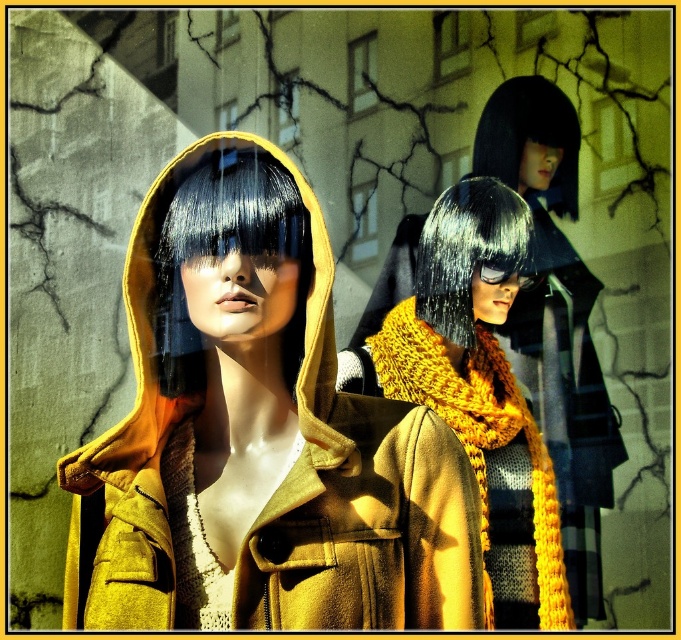
You are a photographer setting up a shoot in this scene. You need to position a spotlight so that it illuminates both the shiny black hair at center and the black silky hair at upper center without casting shadows over other parts of the image. Based on their positions, where should you place the spotlight relative to these two objects?

The shiny black hair at center is to the left of the black silky hair at upper center. To avoid casting shadows over other parts of the image, the spotlight should be placed to the right of both the shiny black hair at center and the black silky hair at upper center.

You are a fashion designer examining the mannequin in the image. You need to adjust the placement of the knitted yellow scarf at center and the black matte wig at center so that the scarf is above the wig. Is this possible without moving the wig?

The knitted yellow scarf at center is currently located below the black matte wig at center. To place the scarf above the wig without moving the wig, you would need to reposition the scarf to a position higher up on the mannequin, such as around the neck area above the wig or adjusting its draping to ensure it appears above the wig.